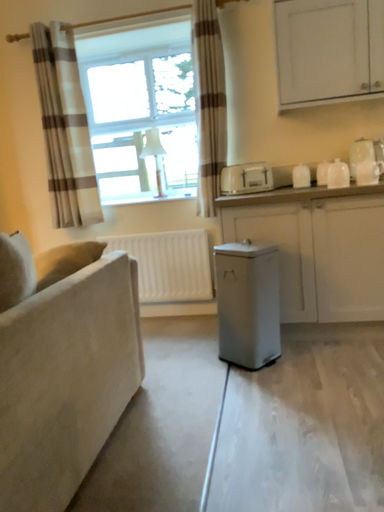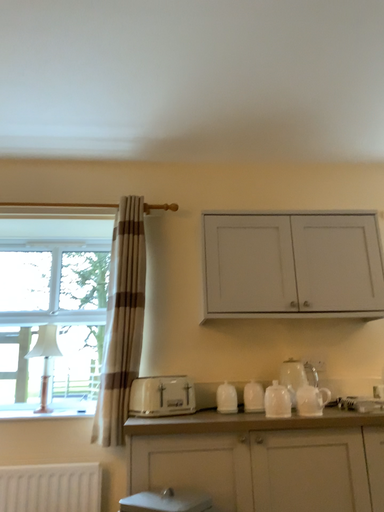
Question: Which way did the camera rotate in the video?

Choices:
 (A) rotated upward
 (B) rotated downward

Answer: (A)